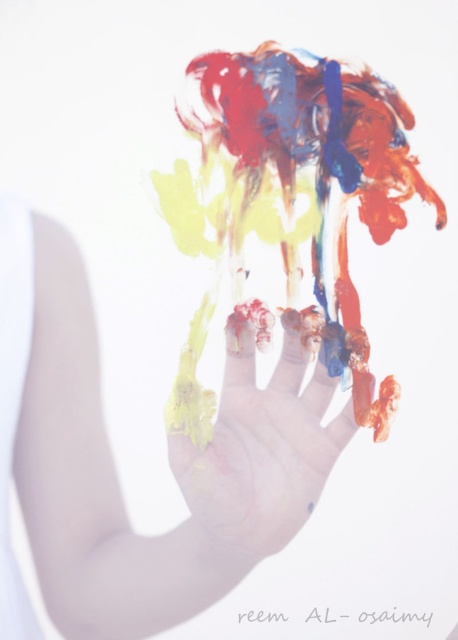
You are an art restorer examining two hands in the image. The painted hand at center and the painted plastic hand at center. Which one is positioned higher in the image?

The painted hand at center is positioned higher than the painted plastic hand at center.

You are an art teacher observing a child who has painted both a real hand and a plastic hand. You notice that the painted hand at center and the painted plastic hand at center are both in the artwork. Which one is bigger?

The painted hand at center is larger than the painted plastic hand at center.